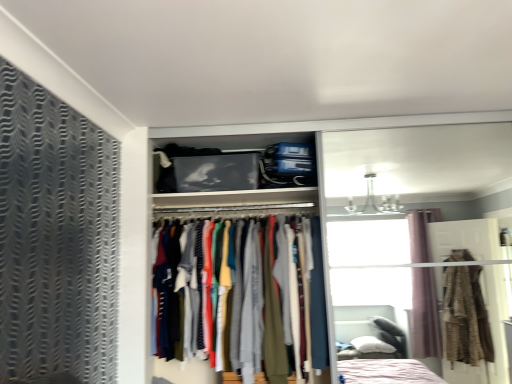
Describe the element at coordinates (244, 201) in the screenshot. I see `white fabric clothes rack at center` at that location.

Image resolution: width=512 pixels, height=384 pixels. Find the location of `white fabric clothes rack at center`. white fabric clothes rack at center is located at coordinates (244, 201).

Where is `white fabric clothes rack at center`? The height and width of the screenshot is (384, 512). white fabric clothes rack at center is located at coordinates (244, 201).